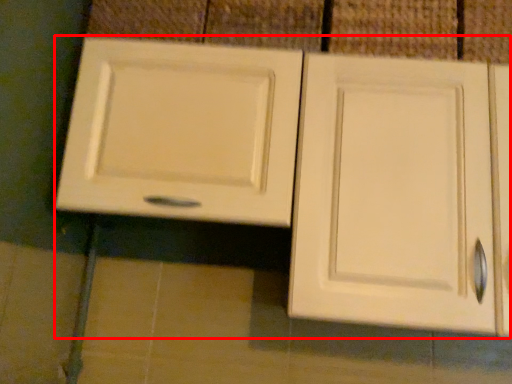
Question: Considering the relative positions of cabinetry (annotated by the red box) and tile in the image provided, where is cabinetry (annotated by the red box) located with respect to the staircase?

Choices:
 (A) left
 (B) right

Answer: (A)